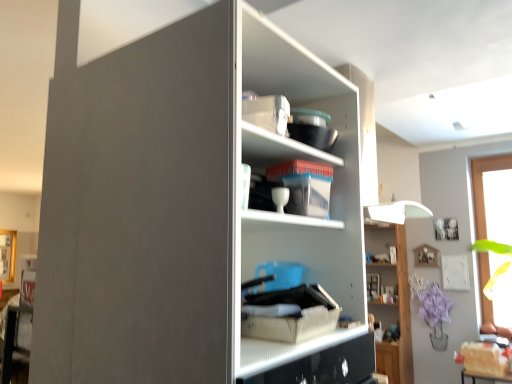
Question: From a real-world perspective, relative to matte cardboard box at center, is wooden shelf at upper right, which is the second shelf from left to right, vertically above or below?

Choices:
 (A) below
 (B) above

Answer: (A)

Question: Based on their positions, is wooden shelf at upper right, arranged as the 1th shelf when viewed from the back, located to the left or right of matte cardboard box at center?

Choices:
 (A) left
 (B) right

Answer: (B)

Question: Based on their relative distances, which object is farther from the clear plastic container at upper center, which is the 2th shelf from bottom to top?

Choices:
 (A) matte cardboard box at center
 (B) transparent glass window at right
 (C) wooden shelf at upper right, which appears as the 2th shelf when viewed from the front
 (D) matte gray cupboard at center
 (E) matte white cabinet at center

Answer: (B)

Question: Estimate the real-world distances between objects in this image. Which object is farther from the wooden shelf at upper right, marked as the first shelf in a bottom-to-top arrangement?

Choices:
 (A) matte gray cupboard at center
 (B) clear plastic container at upper center, the 2th shelf in the back-to-front sequence
 (C) matte white cabinet at center
 (D) transparent glass window at right
 (E) matte cardboard box at center

Answer: (E)